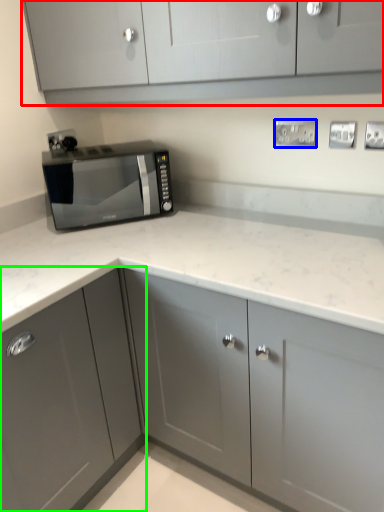
Question: Which object is the farthest from cabinetry (highlighted by a red box)? Choose among these: electric outlet (highlighted by a blue box) or cabinetry (highlighted by a green box).

Choices:
 (A) electric outlet
 (B) cabinetry

Answer: (B)